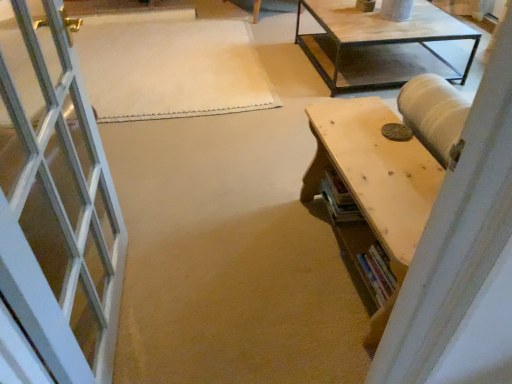
Question: Does white woven mat at center have a larger size compared to wooden table at right?

Choices:
 (A) no
 (B) yes

Answer: (A)

Question: Is white woven mat at center positioned with its back to wooden table at right?

Choices:
 (A) yes
 (B) no

Answer: (B)

Question: Is white woven mat at center located outside wooden table at right?

Choices:
 (A) yes
 (B) no

Answer: (A)

Question: From the image's perspective, is white woven mat at center over wooden table at right?

Choices:
 (A) yes
 (B) no

Answer: (A)

Question: Is white woven mat at center smaller than wooden table at right?

Choices:
 (A) yes
 (B) no

Answer: (A)

Question: From the image's perspective, is white woven mat at center under wooden table at right?

Choices:
 (A) yes
 (B) no

Answer: (B)

Question: From the image's perspective, is wooden table at right beneath white woven mat at center?

Choices:
 (A) no
 (B) yes

Answer: (B)

Question: Is wooden table at right bigger than white woven mat at center?

Choices:
 (A) yes
 (B) no

Answer: (A)

Question: From a real-world perspective, is wooden table at right beneath white woven mat at center?

Choices:
 (A) no
 (B) yes

Answer: (A)

Question: From a real-world perspective, is wooden table at right located higher than white woven mat at center?

Choices:
 (A) no
 (B) yes

Answer: (B)

Question: Is wooden table at right facing towards white woven mat at center?

Choices:
 (A) yes
 (B) no

Answer: (B)

Question: Can you confirm if wooden table at right is positioned to the right of white woven mat at center?

Choices:
 (A) no
 (B) yes

Answer: (B)

Question: In terms of height, does wooden table at right look taller or shorter compared to white woven mat at center?

Choices:
 (A) short
 (B) tall

Answer: (B)